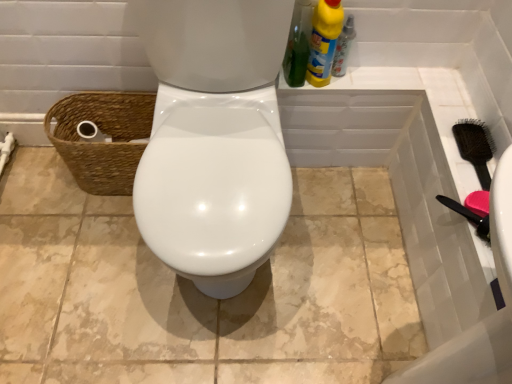
The height and width of the screenshot is (384, 512). I want to click on vacant space situated on the left part of brown woven basket at left, so click(35, 180).